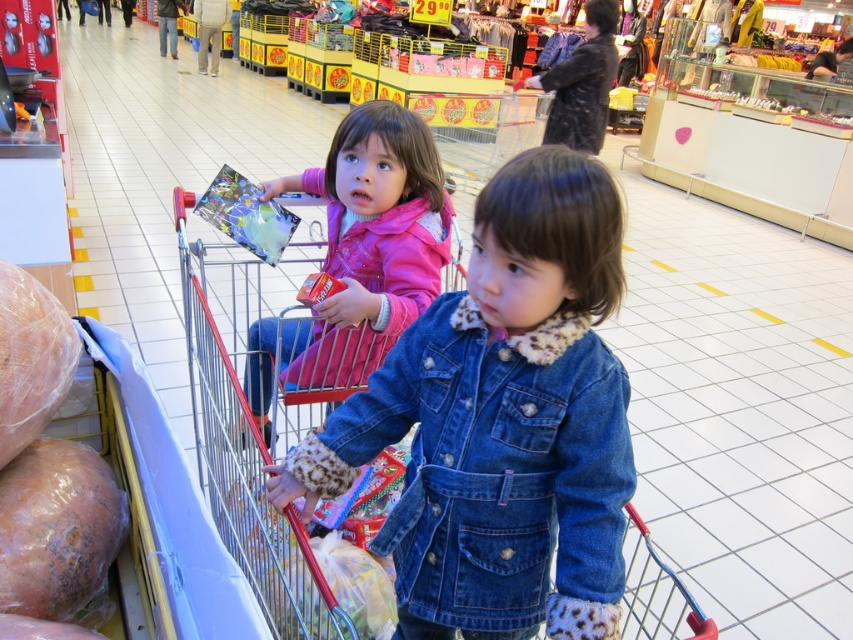
You are a customer in a supermarket and you see the metallic red shopping cart at center and the pink fleece jacket at upper left. Which object is closer to the bottom of the image?

The metallic red shopping cart at center is located below the pink fleece jacket at upper left, so it is closer to the bottom of the image.

You are a store employee checking the items in the supermarket. You notice the pink fleece jacket at upper left and the rotten plastic bag at lower left. Which item is wider?

The pink fleece jacket at upper left is wider than the rotten plastic bag at lower left because the pink fleece jacket at upper left has a greater width compared to the rotten plastic bag at lower left.

You are a supermarket employee who needs to place a new sign between the pink fleece jacket at upper left and the rotten plastic bag at lower left. Based on their positions, which object should the sign be closer to the bottom of?

The sign should be closer to the bottom of the rotten plastic bag at lower left because the pink fleece jacket at upper left is located to the right of the rotten plastic bag at lower left, implying the plastic bag is lower in position.